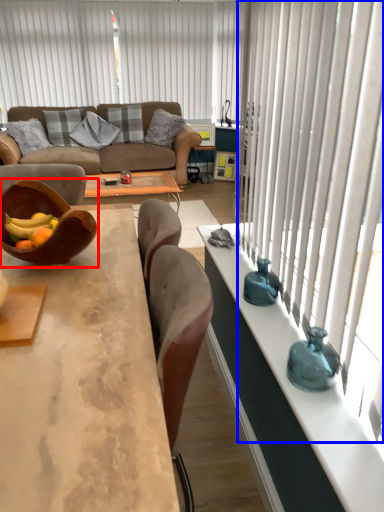
Question: Which object appears closest to the camera in this image, bowl (highlighted by a red box) or curtain (highlighted by a blue box)?

Choices:
 (A) bowl
 (B) curtain

Answer: (B)